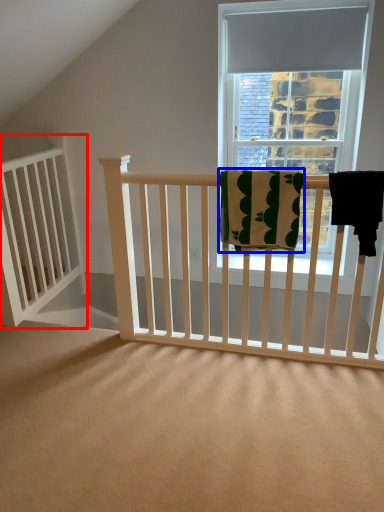
Question: Which object appears farthest to the camera in this image, balustrade (highlighted by a red box) or beach towel (highlighted by a blue box)?

Choices:
 (A) balustrade
 (B) beach towel

Answer: (A)